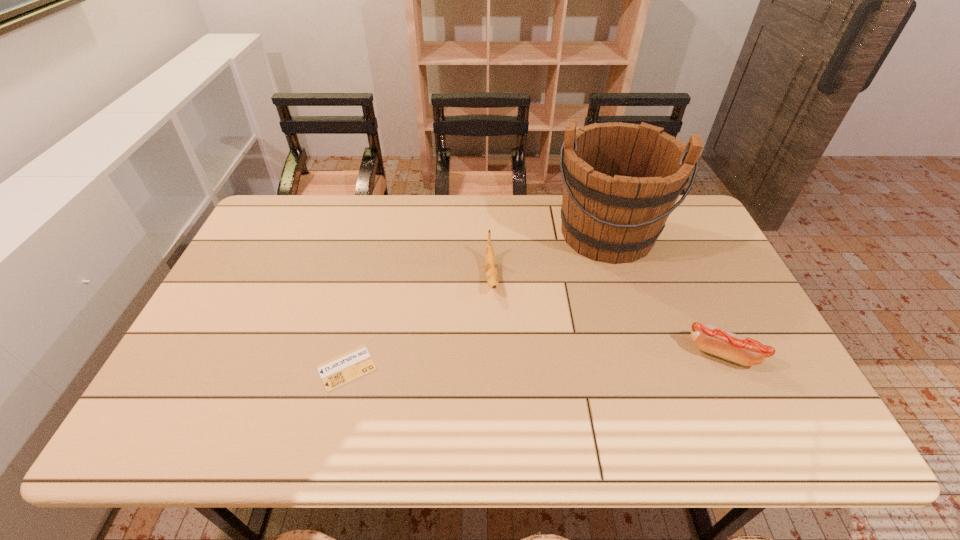
The width and height of the screenshot is (960, 540). I want to click on the leftmost object, so click(336, 372).

The image size is (960, 540). I want to click on the shortest object, so click(x=336, y=372).

This screenshot has width=960, height=540. In order to click on the third tallest object in this screenshot , I will do `click(742, 350)`.

Locate an element on the screen. This screenshot has width=960, height=540. banana is located at coordinates (490, 263).

Where is `the second object from left to right`? The width and height of the screenshot is (960, 540). the second object from left to right is located at coordinates (490, 263).

The image size is (960, 540). What are the coordinates of `wine bucket` in the screenshot? It's located at (621, 181).

The width and height of the screenshot is (960, 540). What are the coordinates of `vacant space located 0.270m on the left of the shortest object` in the screenshot? It's located at (207, 368).

This screenshot has width=960, height=540. Find the location of `vacant position located 0.300m on the back of the sausage`. vacant position located 0.300m on the back of the sausage is located at coordinates (678, 258).

Find the location of `free point located on the peel of the banana from the top`. free point located on the peel of the banana from the top is located at coordinates (496, 330).

The width and height of the screenshot is (960, 540). Identify the location of vacant space located on the peel of the banana from the top. (495, 327).